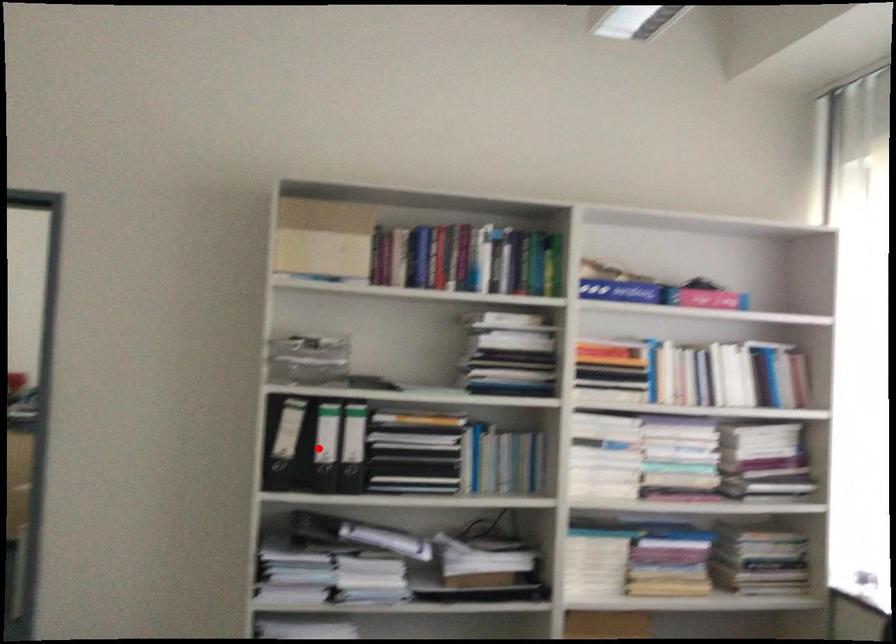
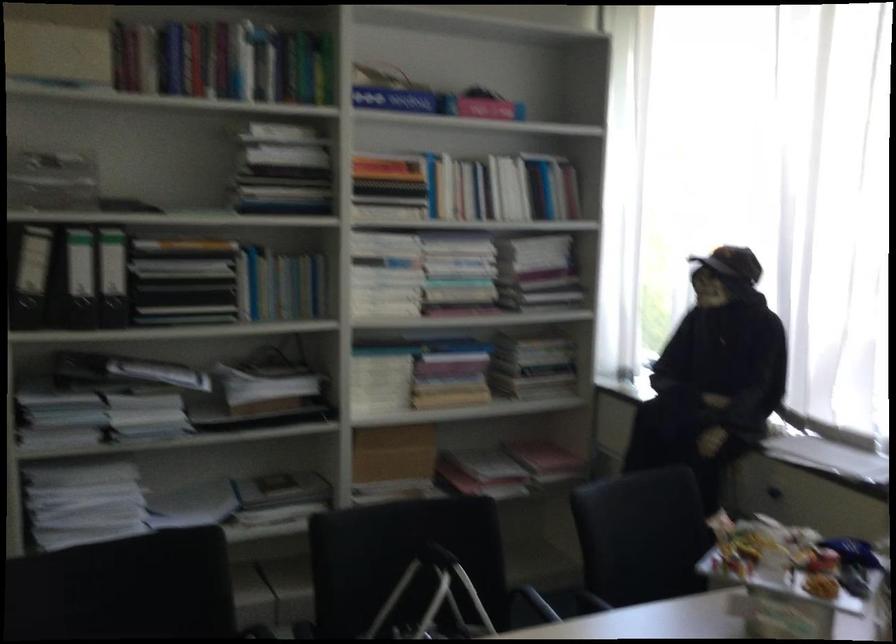
Question: I am providing you with two images of the same scene from different viewpoints. A red point is marked on the first image. Can you still see the location of the red point in image 2?

Choices:
 (A) Yes
 (B) No

Answer: (A)